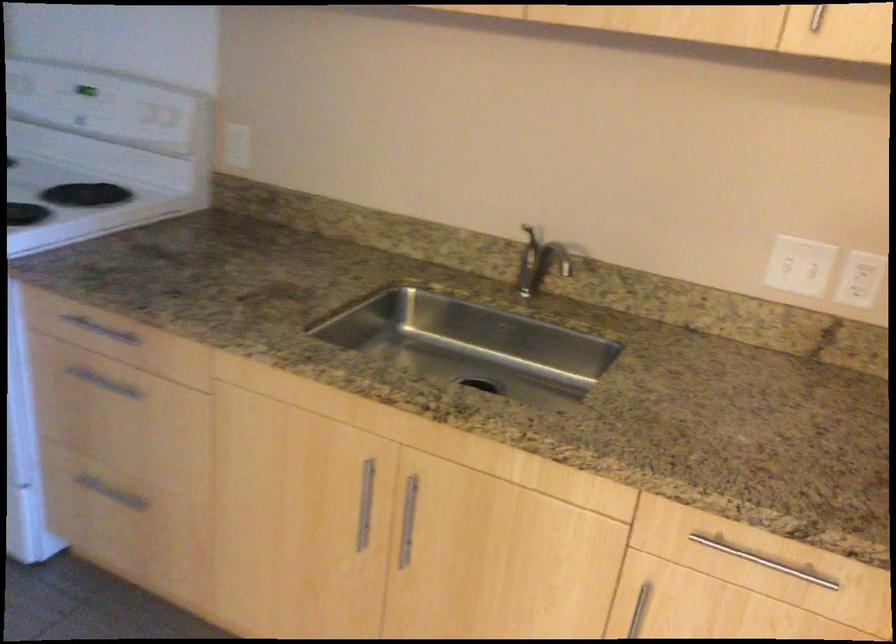
This screenshot has height=644, width=896. I want to click on faucet handle, so click(x=545, y=251).